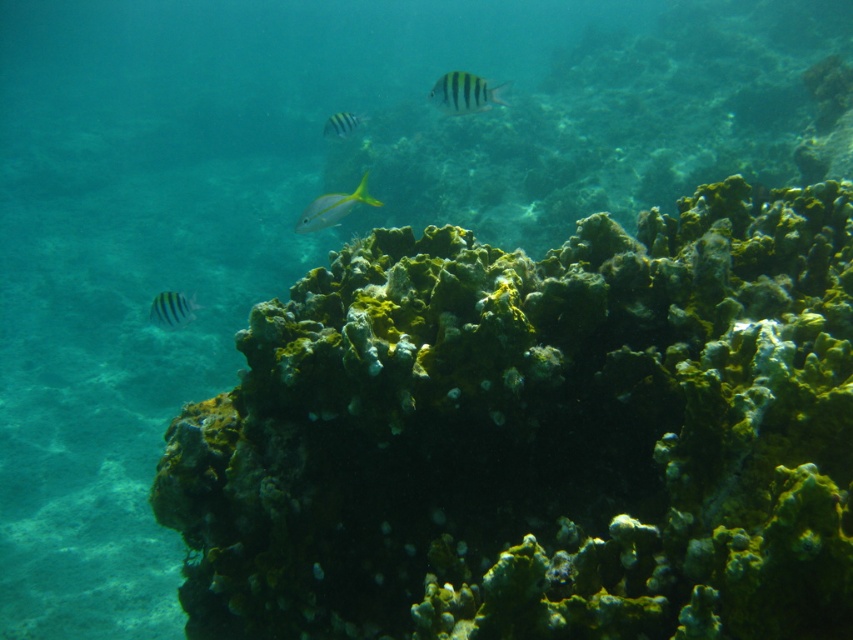
Question: Is striped matte fish at upper center positioned in front of striped yellow and black fish at upper center?

Choices:
 (A) no
 (B) yes

Answer: (B)

Question: Observing the image, what is the correct spatial positioning of greenish-yellow coral at center in reference to yellow matte fish at center?

Choices:
 (A) above
 (B) below

Answer: (B)

Question: Considering the relative positions of striped matte fish at left and striped yellow and black fish at upper center in the image provided, where is striped matte fish at left located with respect to striped yellow and black fish at upper center?

Choices:
 (A) right
 (B) left

Answer: (B)

Question: Which point is farther to the camera?

Choices:
 (A) greenish-yellow coral at center
 (B) striped matte fish at upper center
 (C) striped yellow and black fish at upper center
 (D) yellow matte fish at center

Answer: (C)

Question: Which point is closer to the camera taking this photo?

Choices:
 (A) (740, 476)
 (B) (343, 115)

Answer: (A)

Question: Which object appears closest to the camera in this image?

Choices:
 (A) striped matte fish at left
 (B) yellow matte fish at center

Answer: (B)